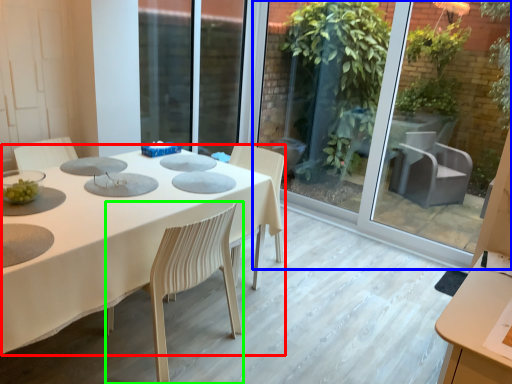
Question: Based on their relative distances, which object is farther from table (highlighted by a red box)? Choose from glass door (highlighted by a blue box) and chair (highlighted by a green box).

Choices:
 (A) glass door
 (B) chair

Answer: (A)